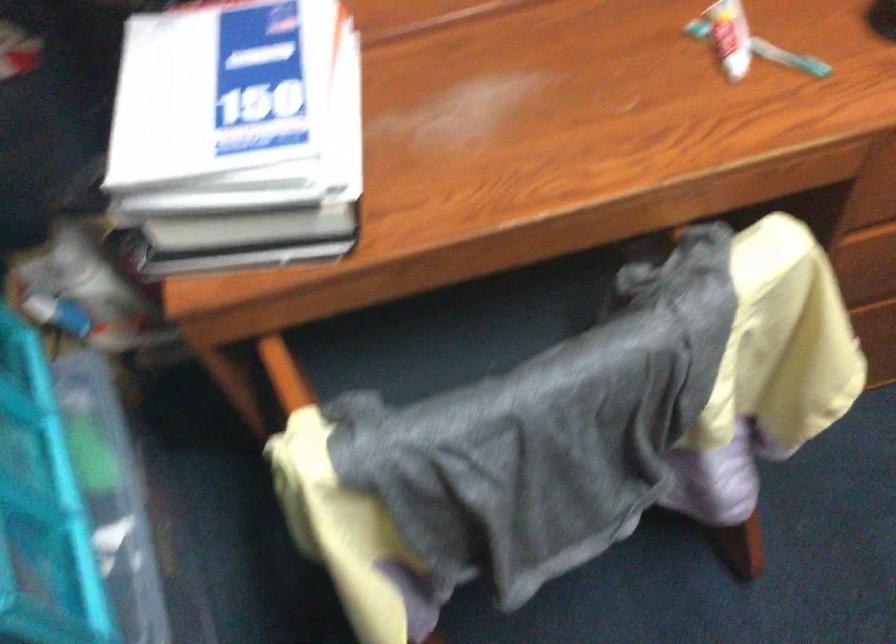
The location [789,58] corresponds to which object?

It corresponds to the toothpaste tube in the image.